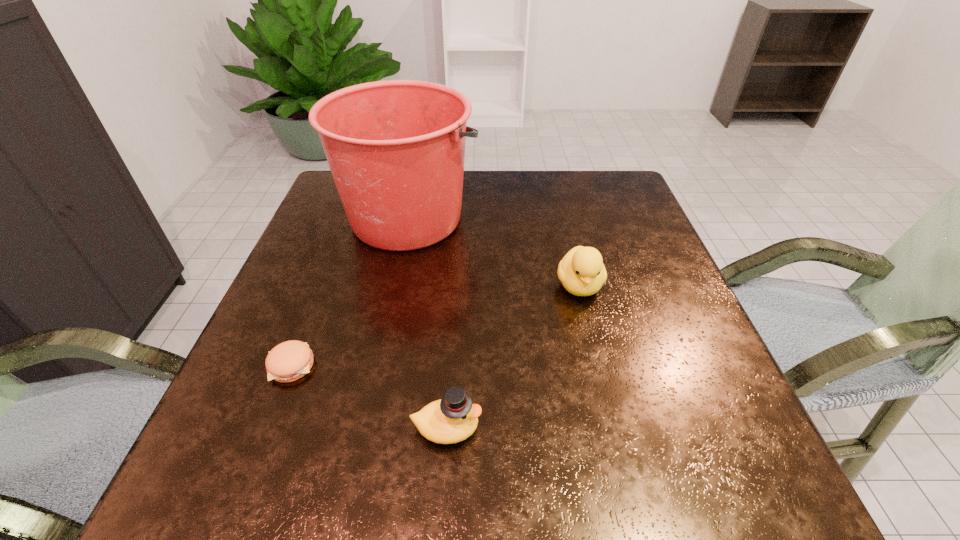
In the image, there is a desktop. At what (x,y) coordinates should I click in order to perform the action: click on free region at the left edge. Please return your answer as a coordinate pair (x, y). The height and width of the screenshot is (540, 960). Looking at the image, I should click on point(318,369).

Find the location of `vacant area at the right edge`. vacant area at the right edge is located at coordinates (699, 406).

This screenshot has height=540, width=960. I want to click on vacant space at the far right corner, so click(622, 173).

You are a GUI agent. You are given a task and a screenshot of the screen. Output one action in this format:
    pyautogui.click(x=<x>, y=<y>)
    Task: Click on the free point between the tallest object and the nearest object
    The width and height of the screenshot is (960, 540).
    Given the screenshot: What is the action you would take?
    pyautogui.click(x=428, y=323)

Find the location of a particular element. Image resolution: width=960 pixels, height=540 pixels. free space between the tallest object and the nearer duck is located at coordinates (428, 323).

Where is `vacant point located between the taller duck and the shortest object`? vacant point located between the taller duck and the shortest object is located at coordinates (435, 325).

Where is `free space between the left duck and the third farthest object`? This screenshot has height=540, width=960. free space between the left duck and the third farthest object is located at coordinates (369, 396).

The width and height of the screenshot is (960, 540). I want to click on empty location between the taller duck and the tallest object, so click(494, 252).

The width and height of the screenshot is (960, 540). Find the location of `unoccupied area between the tallest object and the shortest object`. unoccupied area between the tallest object and the shortest object is located at coordinates (350, 292).

At what (x,y) coordinates should I click in order to perform the action: click on empty space that is in between the second tallest object and the shorter duck. Please return your answer as a coordinate pair (x, y). This screenshot has height=540, width=960. Looking at the image, I should click on (513, 356).